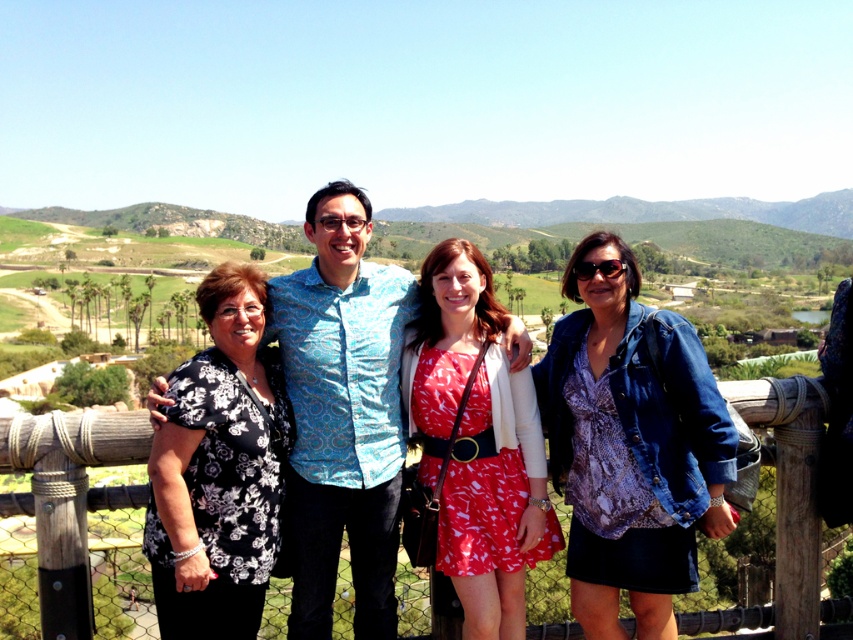
You are trying to decide which item to take with you for a cooler evening. The scene shows a group of people in a sunny outdoor setting with palm trees. You see a denim jacket at right and a black floral blouse at left. Which clothing item is positioned to the right side of the other?

The denim jacket at right is to the right of the black floral blouse at left.